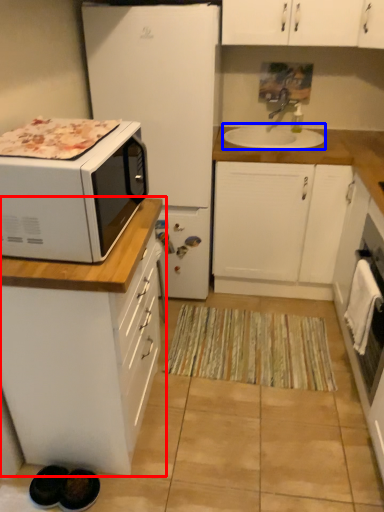
Question: Among these objects, which one is nearest to the camera, cabinetry (highlighted by a red box) or sink (highlighted by a blue box)?

Choices:
 (A) cabinetry
 (B) sink

Answer: (A)